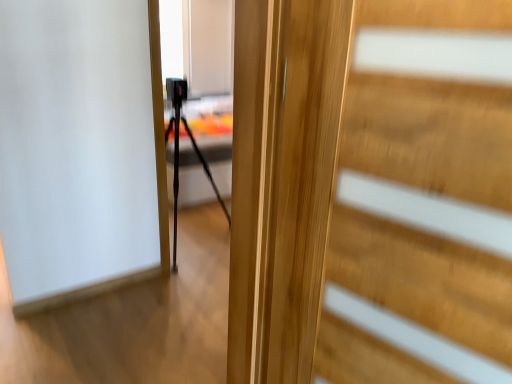
The width and height of the screenshot is (512, 384). In order to click on black matte tripod at center in this screenshot , I will do `click(179, 165)`.

What do you see at coordinates (179, 165) in the screenshot? Image resolution: width=512 pixels, height=384 pixels. I see `black matte tripod at center` at bounding box center [179, 165].

Where is `wooden door at center`? The image size is (512, 384). wooden door at center is located at coordinates (351, 208).

The image size is (512, 384). What do you see at coordinates (351, 208) in the screenshot?
I see `wooden door at center` at bounding box center [351, 208].

The image size is (512, 384). In order to click on black matte tripod at center in this screenshot , I will do `click(179, 165)`.

Does black matte tripod at center appear on the right side of wooden door at center?

Incorrect, black matte tripod at center is not on the right side of wooden door at center.

In the scene shown: Is black matte tripod at center behind wooden door at center?

Yes, it is.

Does point (179, 106) come in front of point (255, 76)?

No, (179, 106) is behind (255, 76).

From the image's perspective, which one is positioned lower, black matte tripod at center or wooden door at center?

wooden door at center appears lower in the image.

From a real-world perspective, is black matte tripod at center physically located above or below wooden door at center?

In terms of real-world spatial position, black matte tripod at center is below wooden door at center.

Considering the relative sizes of black matte tripod at center and wooden door at center in the image provided, is black matte tripod at center thinner than wooden door at center?

No, black matte tripod at center is not thinner than wooden door at center.

Based on the photo, between black matte tripod at center and wooden door at center, which one has less height?

With less height is wooden door at center.

Is black matte tripod at center bigger or smaller than wooden door at center?

In the image, black matte tripod at center appears to be larger than wooden door at center.

Can we say black matte tripod at center lies outside wooden door at center?

Yes, black matte tripod at center is located beyond the bounds of wooden door at center.

Is black matte tripod at center far away from wooden door at center?

Indeed, black matte tripod at center is not near wooden door at center.

Is black matte tripod at center positioned with its back to wooden door at center?

No, wooden door at center is not at the back of black matte tripod at center.

How different are the orientations of black matte tripod at center and wooden door at center in degrees?

They differ by 135 degrees in their facing directions.

You are a GUI agent. You are given a task and a screenshot of the screen. Output one action in this format:
    pyautogui.click(x=<x>, y=<y>)
    Task: Click on the door on the right of the black matte tripod at center
    The height and width of the screenshot is (384, 512).
    Given the screenshot: What is the action you would take?
    pyautogui.click(x=351, y=208)

In the scene shown: Considering the positions of objects wooden door at center and black matte tripod at center in the image provided, who is more to the right, wooden door at center or black matte tripod at center?

From the viewer's perspective, wooden door at center appears more on the right side.

In the image, is wooden door at center positioned in front of or behind black matte tripod at center?

Clearly, wooden door at center is in front of black matte tripod at center.

Does point (457, 115) lie behind point (206, 164)?

No, it is in front of (206, 164).

From the image's perspective, is wooden door at center on top of black matte tripod at center?

Incorrect, from the image's perspective, wooden door at center is lower than black matte tripod at center.

From a real-world perspective, is wooden door at center over black matte tripod at center?

Indeed, from a real-world perspective, wooden door at center stands above black matte tripod at center.

Which object is wider, wooden door at center or black matte tripod at center?

Wider between the two is black matte tripod at center.

Considering the sizes of wooden door at center and black matte tripod at center in the image, is wooden door at center taller or shorter than black matte tripod at center?

Clearly, wooden door at center is shorter compared to black matte tripod at center.

Looking at this image, considering the relative sizes of wooden door at center and black matte tripod at center in the image provided, is wooden door at center smaller than black matte tripod at center?

Yes.

Is wooden door at center not inside black matte tripod at center?

Yes, wooden door at center is outside of black matte tripod at center.

Is wooden door at center not close to black matte tripod at center?

wooden door at center is positioned a significant distance from black matte tripod at center.

Consider the image. Is wooden door at center aimed at black matte tripod at center?

No, wooden door at center is not oriented towards black matte tripod at center.

Can you tell me how much wooden door at center and black matte tripod at center differ in facing direction?

The facing directions of wooden door at center and black matte tripod at center are 135 degrees apart.

Where is `tripod on the left of wooden door at center`? Image resolution: width=512 pixels, height=384 pixels. tripod on the left of wooden door at center is located at coordinates (179, 165).

I want to click on door located above the black matte tripod at center (from a real-world perspective), so click(x=351, y=208).

The width and height of the screenshot is (512, 384). In order to click on tripod below the wooden door at center (from a real-world perspective) in this screenshot , I will do `click(179, 165)`.